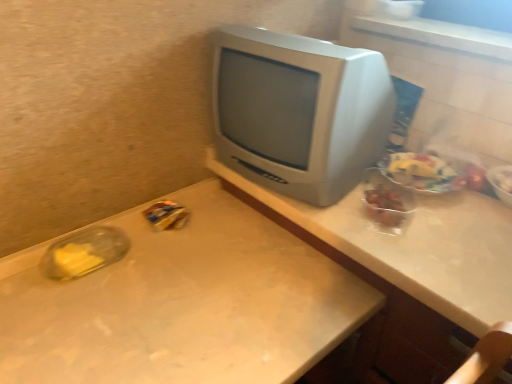
Question: Relative to white matte desk at center, is translucent plastic bag at right, which is the 2th food in right-to-left order, in front or behind?

Choices:
 (A) front
 (B) behind

Answer: (B)

Question: Looking at their shapes, would you say translucent plastic bag at right, which is the third food in left-to-right order, is wider or thinner than white matte desk at center?

Choices:
 (A) thin
 (B) wide

Answer: (A)

Question: Which object is the farthest from the satin silver monitor at center?

Choices:
 (A) translucent plastic bowl at upper right, the 1th food in the right-to-left sequence
 (B) yellow plastic bag at center-left, which is counted as the first food, starting from the left
 (C) translucent plastic container at right, which is counted as the third food, starting from the right
 (D) translucent plastic bag at right, which is the third food in left-to-right order
 (E) matte gray computer desk at center

Answer: (A)

Question: Which is nearer to the white matte desk at center?

Choices:
 (A) clear plastic container at left
 (B) matte gray computer desk at center
 (C) translucent plastic container at right, which appears as the 2th food when viewed from the left
 (D) translucent plastic bowl at upper right, the fourth food in the left-to-right sequence
 (E) yellow plastic bag at center-left, which appears as the 4th food when viewed from the right

Answer: (A)